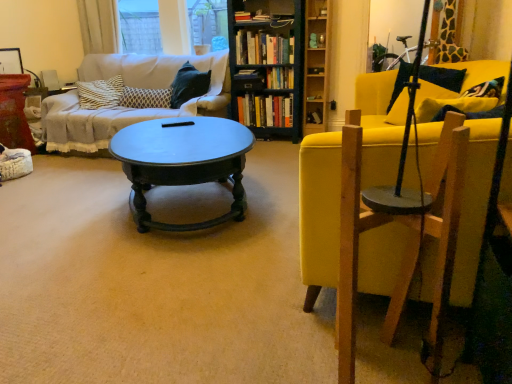
Image resolution: width=512 pixels, height=384 pixels. I want to click on vacant position to the left of wooden swivel chair at right, so click(296, 348).